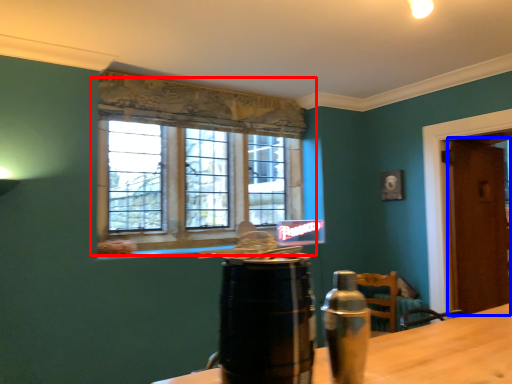
Question: Which object appears farthest to the camera in this image, window (highlighted by a red box) or door (highlighted by a blue box)?

Choices:
 (A) window
 (B) door

Answer: (B)